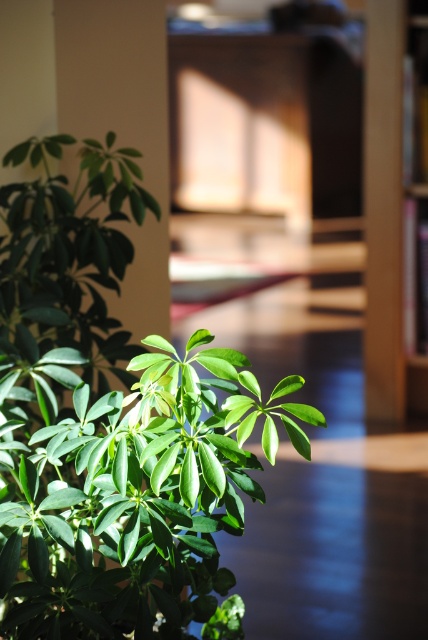
Question: Which point is farther from the camera taking this photo?

Choices:
 (A) (148, 577)
 (B) (368, 301)

Answer: (B)

Question: Observing the image, what is the correct spatial positioning of green leafy plant at lower left in reference to brown wooden bookshelf at right?

Choices:
 (A) below
 (B) above

Answer: (A)

Question: Is green leafy plant at lower left to the left of brown wooden bookshelf at right from the viewer's perspective?

Choices:
 (A) no
 (B) yes

Answer: (B)

Question: Is the position of green leafy plant at lower left less distant than that of brown wooden bookshelf at right?

Choices:
 (A) yes
 (B) no

Answer: (A)